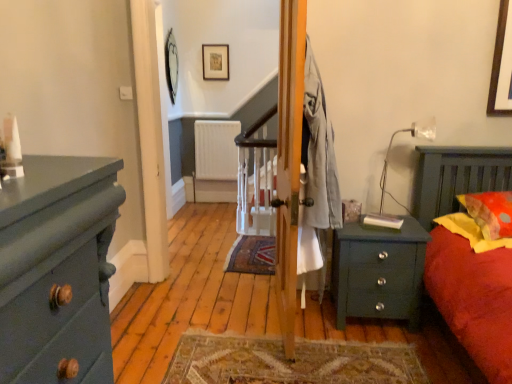
Question: Is matte dark green dresser at left to the left or to the right of white matte radiator at center in the image?

Choices:
 (A) left
 (B) right

Answer: (A)

Question: Relative to white matte radiator at center, is matte dark green dresser at left in front or behind?

Choices:
 (A) front
 (B) behind

Answer: (A)

Question: Which of these objects is positioned closest to the wooden picture frame at upper center, placed as the second picture frame when sorted from left to right?

Choices:
 (A) metallic mirror at upper center, which is the second picture frame from right to left
 (B) yellow fabric pillow at right, which appears as the 1th pillow when ordered from the bottom
 (C) orange dotted fabric pillow at right, which ranks as the 2th pillow in bottom-to-top order
 (D) matte dark green dresser at left
 (E) white matte radiator at center

Answer: (A)

Question: Which of these objects is positioned closest to the matte dark green dresser at left?

Choices:
 (A) wooden picture frame at upper center, placed as the second picture frame when sorted from left to right
 (B) white matte radiator at center
 (C) orange dotted fabric pillow at right, which ranks as the 2th pillow in bottom-to-top order
 (D) green matte nightstand at lower right
 (E) metallic mirror at upper center, which is the second picture frame from right to left

Answer: (D)